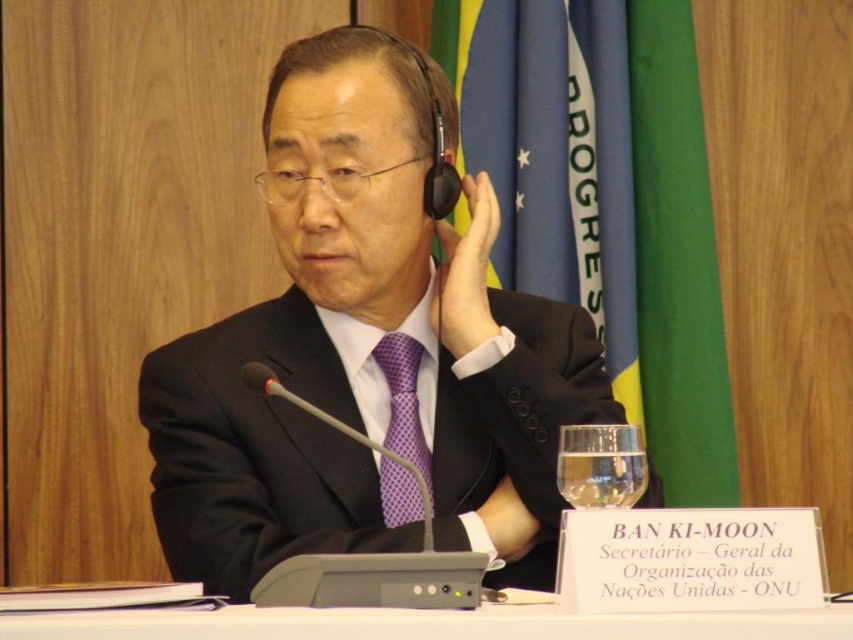
Question: Does black matte suit at center have a lesser width compared to white plastic table at center?

Choices:
 (A) yes
 (B) no

Answer: (A)

Question: Does black matte suit at center appear on the left side of purple dotted tie at center?

Choices:
 (A) no
 (B) yes

Answer: (B)

Question: Which point appears farthest from the camera in this image?

Choices:
 (A) click(241, 397)
 (B) click(846, 627)

Answer: (A)

Question: Which is farther from the purple dotted tie at center?

Choices:
 (A) black matte suit at center
 (B) white plastic table at center

Answer: (B)

Question: Estimate the real-world distances between objects in this image. Which object is farther from the white plastic table at center?

Choices:
 (A) black matte suit at center
 (B) clear glass at lower right
 (C) purple dotted tie at center

Answer: (C)

Question: Where is purple dotted tie at center located in relation to clear glass at lower right in the image?

Choices:
 (A) below
 (B) above

Answer: (B)